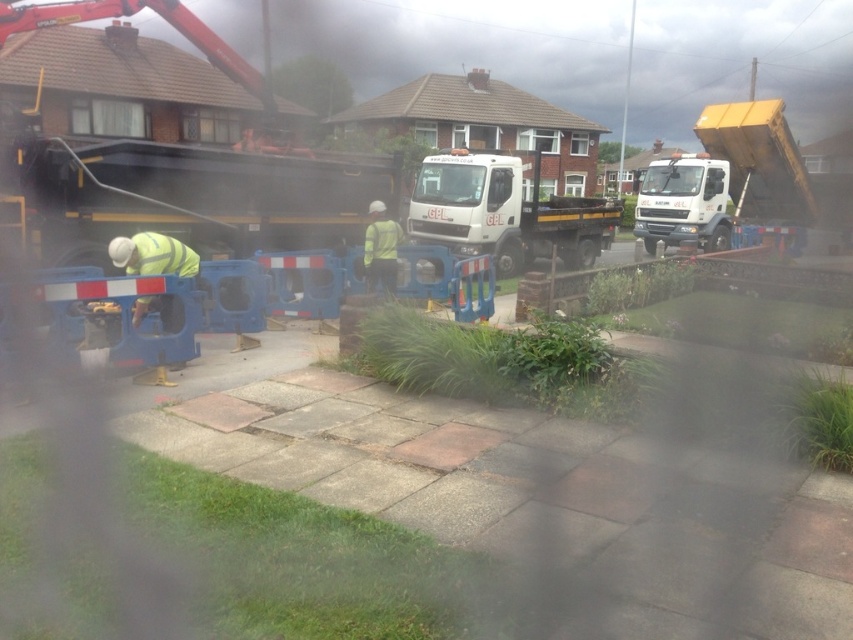
Question: Which object is positioned farthest from the white matte truck at center?

Choices:
 (A) blue plastic barrier at center
 (B) yellow matte truck at upper right

Answer: (A)

Question: Is blue plastic barrier at center to the left of white matte truck at center from the viewer's perspective?

Choices:
 (A) yes
 (B) no

Answer: (A)

Question: Does yellow matte truck at upper right appear over white matte truck at center?

Choices:
 (A) yes
 (B) no

Answer: (B)

Question: Among these objects, which one is nearest to the camera?

Choices:
 (A) blue plastic barrier at center
 (B) white matte truck at center

Answer: (A)

Question: Does blue plastic barrier at center appear on the right side of yellow matte truck at upper right?

Choices:
 (A) yes
 (B) no

Answer: (B)

Question: Based on their relative distances, which object is nearer to the yellow matte truck at upper right?

Choices:
 (A) white matte truck at center
 (B) blue plastic barrier at center

Answer: (A)